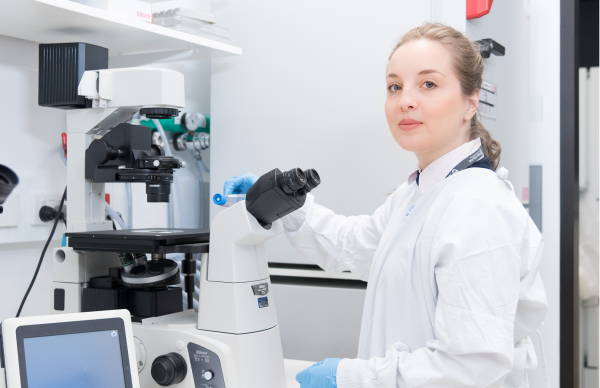
The width and height of the screenshot is (600, 388). Find the location of `knob`. knob is located at coordinates (171, 376).